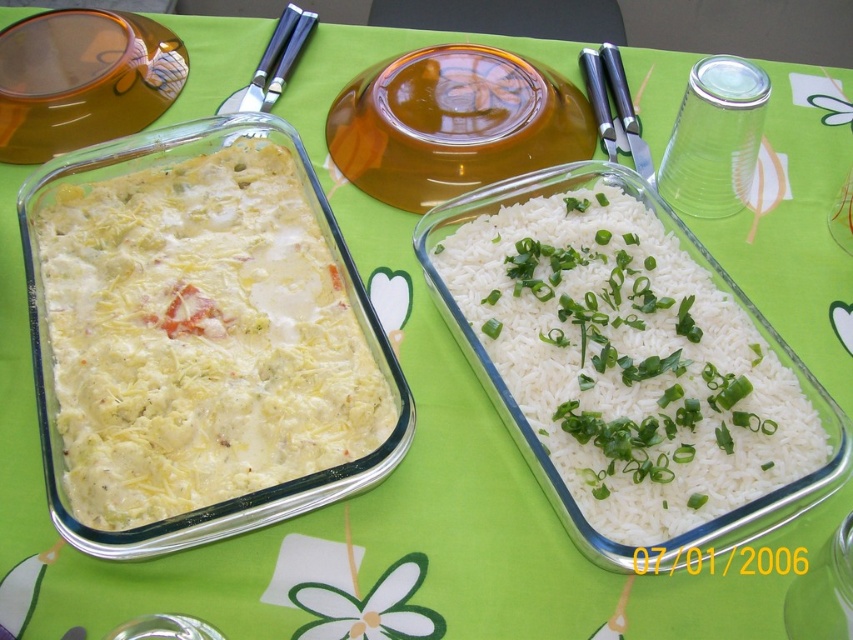
Question: Can you confirm if white creamy cheese casserole at left is positioned to the left of white matte rice at center?

Choices:
 (A) no
 (B) yes

Answer: (B)

Question: Is white creamy cheese casserole at left thinner than white matte rice at center?

Choices:
 (A) no
 (B) yes

Answer: (A)

Question: Which object appears farthest from the camera in this image?

Choices:
 (A) white creamy cheese casserole at left
 (B) white matte rice at center

Answer: (A)

Question: Is white creamy cheese casserole at left above white matte rice at center?

Choices:
 (A) yes
 (B) no

Answer: (A)